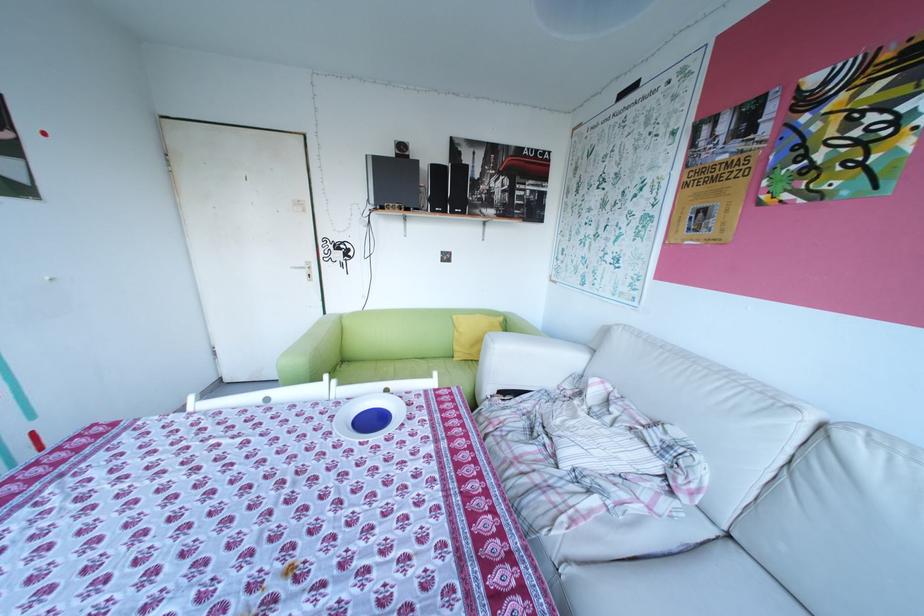
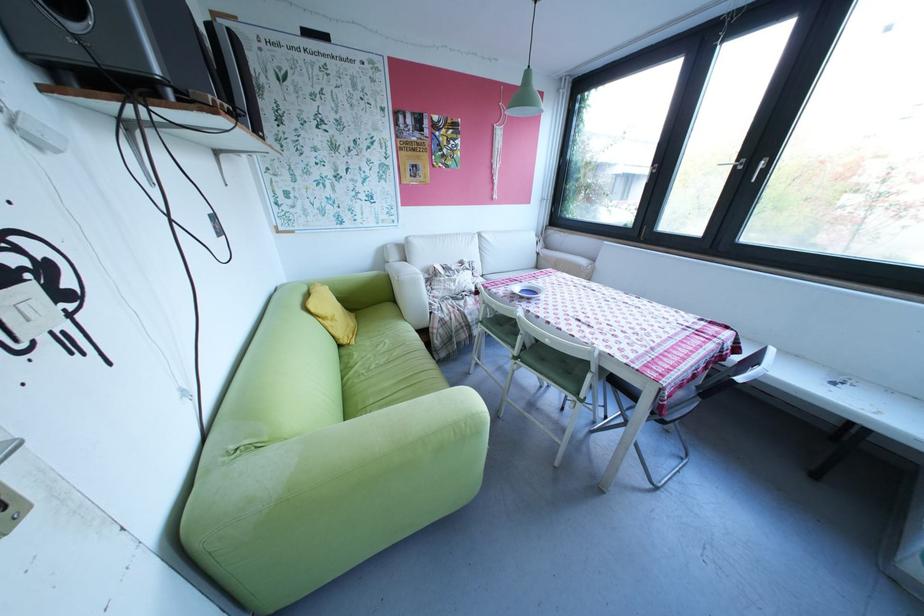
Locate, in the second image, the point that corresponds to [467,359] in the first image.

(366, 342)